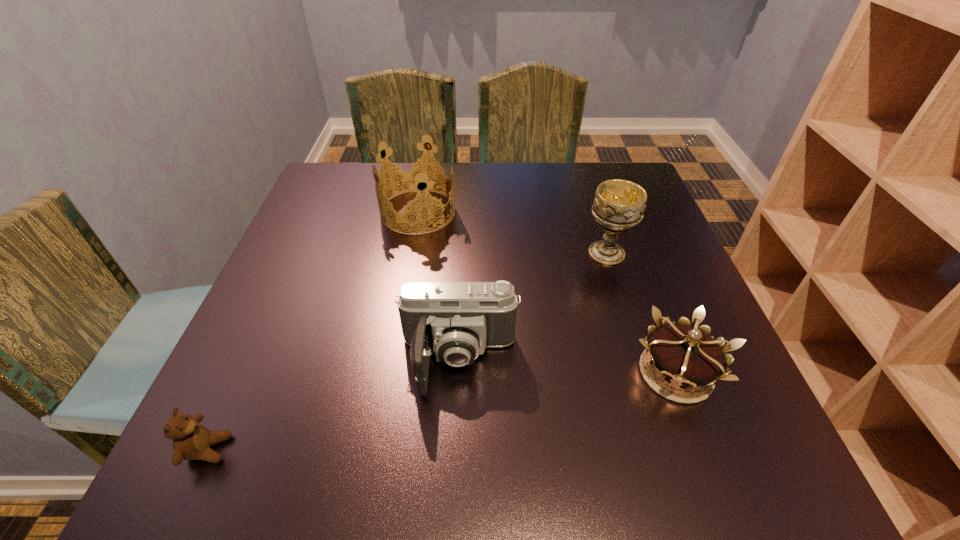
Where is `the fourth nearest object`? the fourth nearest object is located at coordinates (618, 206).

Where is `the left crown`? This screenshot has height=540, width=960. the left crown is located at coordinates (413, 174).

Where is `the farther crown`? the farther crown is located at coordinates (413, 174).

You are a GUI agent. You are given a task and a screenshot of the screen. Output one action in this format:
    pyautogui.click(x=<x>, y=<y>)
    Task: Click on the third shortest object
    The image size is (960, 540).
    Given the screenshot: What is the action you would take?
    pyautogui.click(x=458, y=320)

Where is `the shorter crown`? the shorter crown is located at coordinates (685, 355).

Identify the location of the right crown. (685, 355).

Locate an element on the screen. The image size is (960, 540). the leftmost object is located at coordinates (191, 440).

Identify the location of the nearest object. (191, 440).

What are the coordinates of `free location located on the front of the fourth nearest object` in the screenshot? It's located at (647, 383).

Locate an element on the screen. The height and width of the screenshot is (540, 960). vacant space located 0.300m on the right of the left crown is located at coordinates (572, 211).